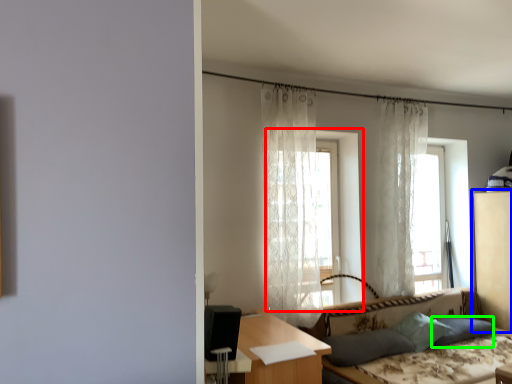
Question: Based on their relative distances, which object is farther from screen door (highlighted by a red box)? Choose from dresser (highlighted by a blue box) and pillow (highlighted by a green box).

Choices:
 (A) dresser
 (B) pillow

Answer: (A)